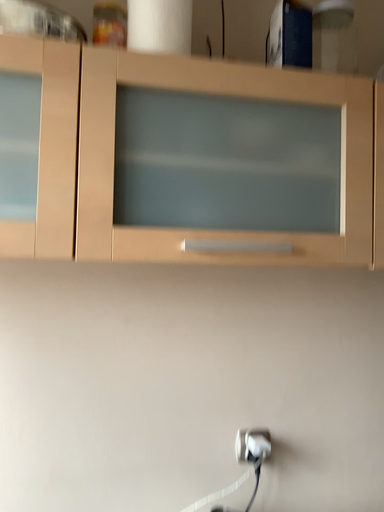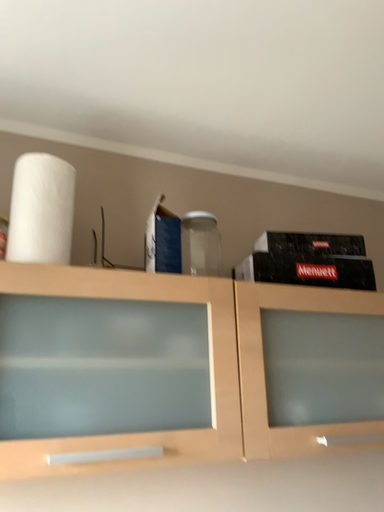
Question: How did the camera likely rotate when shooting the video?

Choices:
 (A) rotated upward
 (B) rotated downward

Answer: (A)